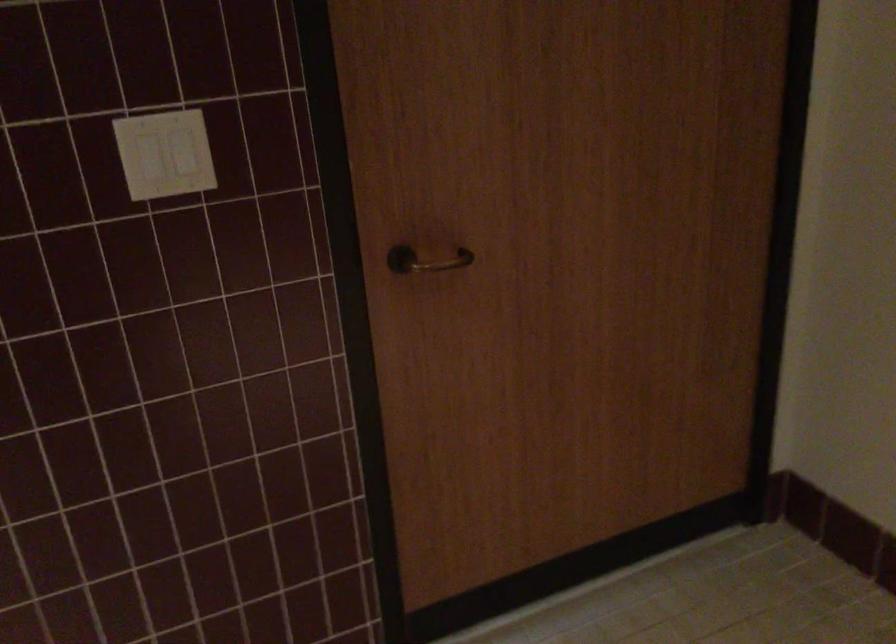
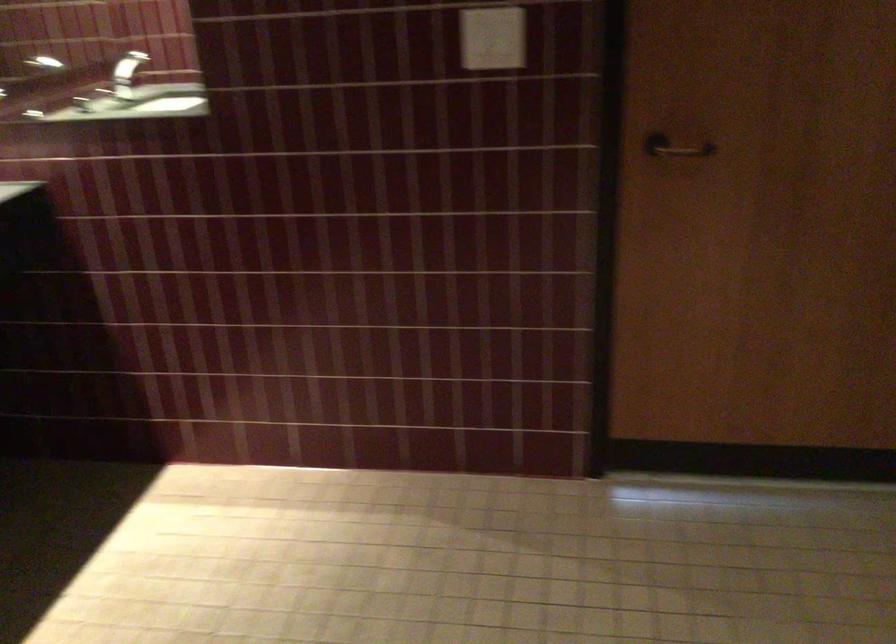
Locate, in the second image, the point that corresponds to (625,410) in the first image.

(857, 321)